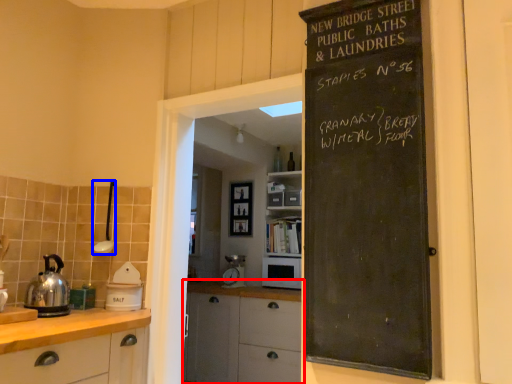
Question: Among these objects, which one is farthest to the camera, cupboard (highlighted by a red box) or appliance (highlighted by a blue box)?

Choices:
 (A) cupboard
 (B) appliance

Answer: (A)